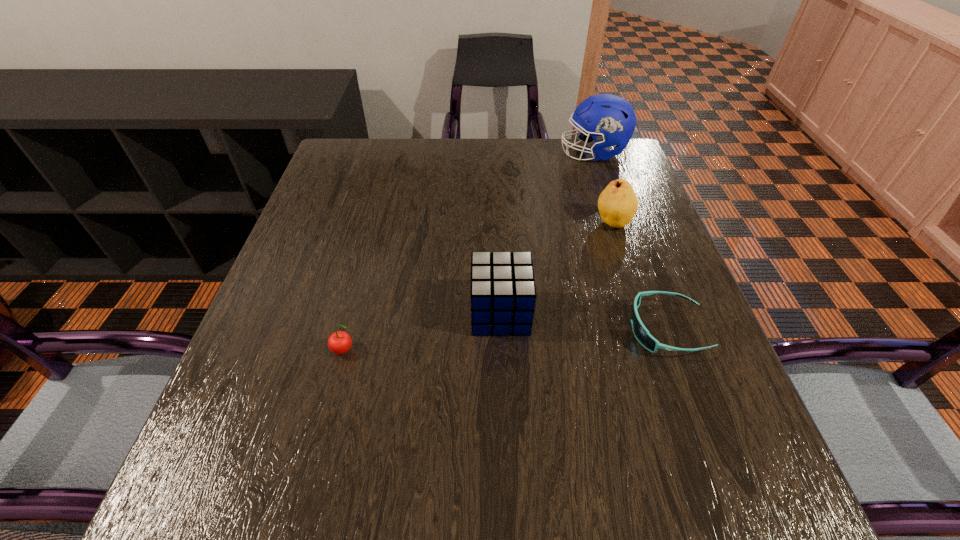
Locate an element on the screen. the farthest object is located at coordinates (611, 120).

Find the location of a particular element. Image resolution: width=960 pixels, height=540 pixels. football helmet is located at coordinates (611, 120).

Locate an element on the screen. The height and width of the screenshot is (540, 960). pear is located at coordinates (617, 204).

Find the location of a particular element. This screenshot has width=960, height=540. cube is located at coordinates (503, 295).

Find the location of a particular element. The image size is (960, 540). the fourth tallest object is located at coordinates (339, 342).

Find the location of a particular element. Image resolution: width=960 pixels, height=540 pixels. cherry is located at coordinates (339, 342).

I want to click on the shortest object, so point(641,333).

Where is `vacant space located 0.070m on the front-facing side of the farthest object`? The width and height of the screenshot is (960, 540). vacant space located 0.070m on the front-facing side of the farthest object is located at coordinates (536, 153).

This screenshot has height=540, width=960. What are the coordinates of `vacant region located 0.190m on the front-facing side of the farthest object` in the screenshot? It's located at (495, 153).

Find the location of a particular element. The width and height of the screenshot is (960, 540). free location located on the front-facing side of the farthest object is located at coordinates (506, 153).